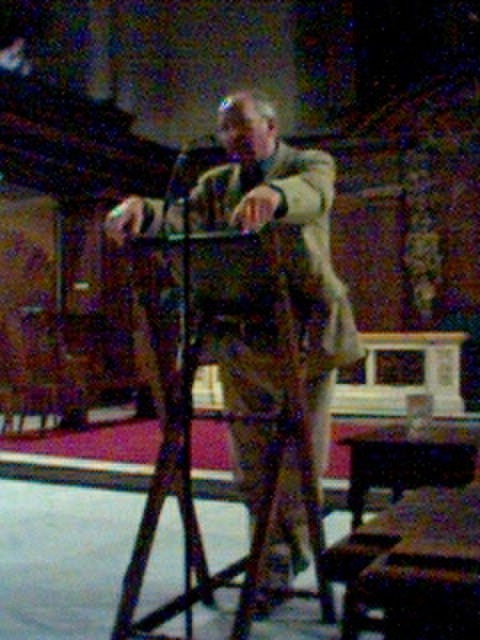
You are an attendee sitting at the back of the room. You see two points marked on the floor in front of the podium. The first point is at coordinates point (188, 460) and the second point is at point (214, 134). Which point is closer to the podium?

Point (188, 460) is in front of point (214, 134), so it is closer to the podium.

You are setting up audio equipment for an event. You have a black matte tripod at center and a matte black microphone at center. Which object should you adjust first if you need to ensure they are both aligned properly?

The black matte tripod at center should be adjusted first because it might be wider than the matte black microphone at center, so ensuring its position is correct will help align the microphone properly.